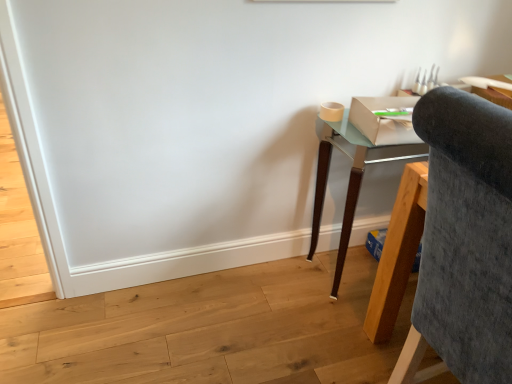
The width and height of the screenshot is (512, 384). Identify the location of vacant space underneath teal glass desk at right (from a real-world perspective). (352, 271).